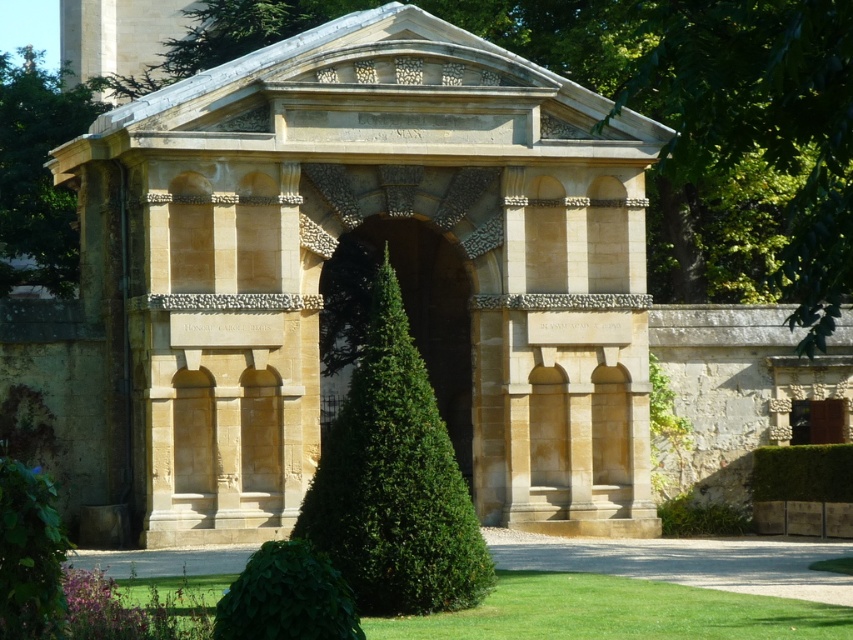
The height and width of the screenshot is (640, 853). What are the coordinates of `green leafy bush at center` in the screenshot? It's located at (393, 481).

Is green leafy bush at center smaller than green leafy hedge at lower center?

Incorrect, green leafy bush at center is not smaller in size than green leafy hedge at lower center.

Which is in front, point (363, 428) or point (260, 557)?

Point (260, 557)

Where is `green leafy bush at center`? This screenshot has width=853, height=640. green leafy bush at center is located at coordinates (393, 481).